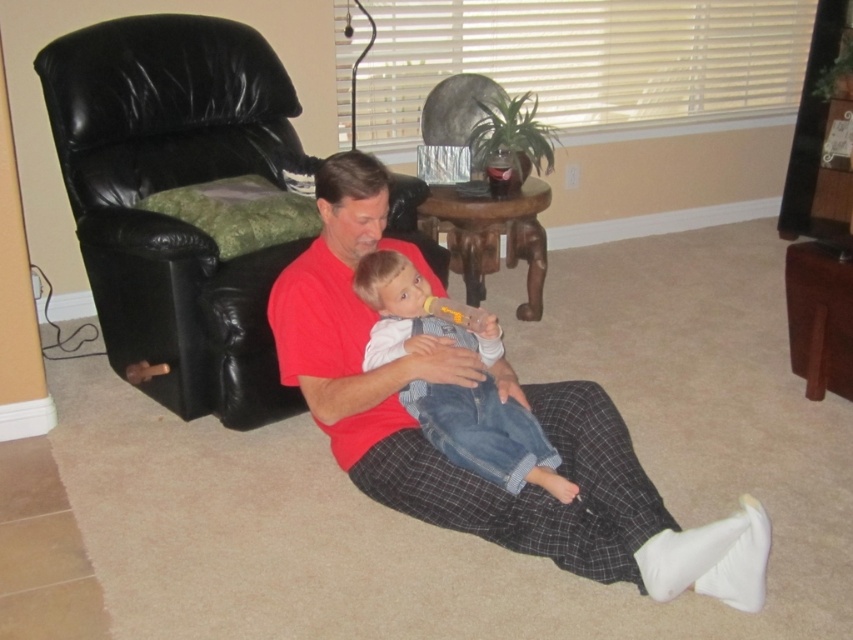
Question: Based on their relative distances, which object is farther from the red cotton shirt at center?

Choices:
 (A) denim overalls at center
 (B) black leather armchair at left

Answer: (B)

Question: Can you confirm if black leather armchair at left is wider than denim overalls at center?

Choices:
 (A) yes
 (B) no

Answer: (A)

Question: Which point is farther to the camera?

Choices:
 (A) (583, 563)
 (B) (438, 428)

Answer: (B)

Question: Among these points, which one is nearest to the camera?

Choices:
 (A) (480, 422)
 (B) (180, 240)
 (C) (621, 465)

Answer: (A)

Question: Where is red cotton shirt at center located in relation to denim overalls at center in the image?

Choices:
 (A) below
 (B) above

Answer: (A)

Question: Can you confirm if red cotton shirt at center is smaller than denim overalls at center?

Choices:
 (A) no
 (B) yes

Answer: (A)